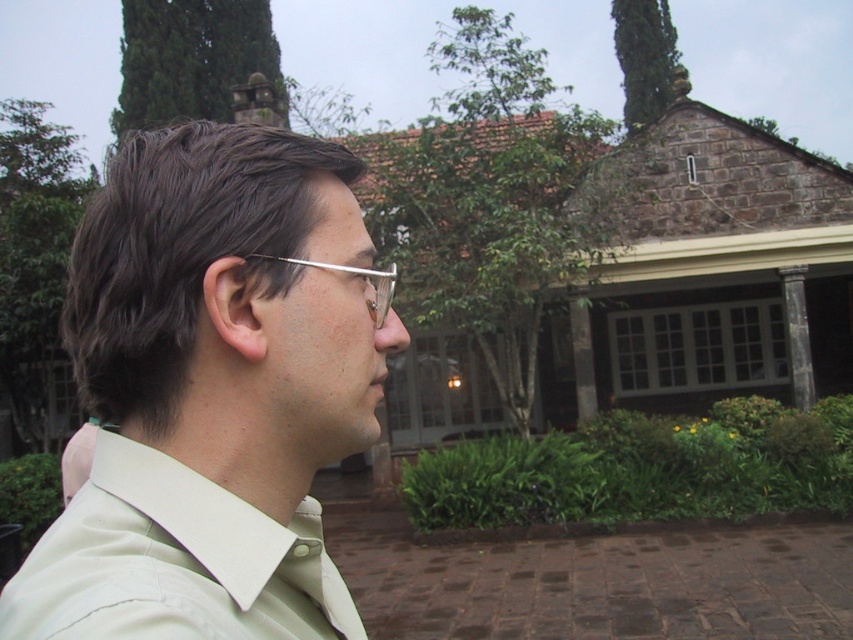
Between light beige shirt at center and beige cotton dress shirt at center, which one is positioned lower?

beige cotton dress shirt at center is lower down.

How distant is light beige shirt at center from beige cotton dress shirt at center?

They are 7.63 centimeters apart.

The height and width of the screenshot is (640, 853). Describe the element at coordinates (212, 392) in the screenshot. I see `light beige shirt at center` at that location.

Identify the location of light beige shirt at center. (212, 392).

Measure the distance between beige cotton dress shirt at center and clear plastic glasses at center.

The distance of beige cotton dress shirt at center from clear plastic glasses at center is 12.92 inches.

Does point (173, 564) lie behind point (372, 275)?

No.

Who is more distant from viewer, (151, 576) or (380, 291)?

Positioned behind is point (380, 291).

Where is `beige cotton dress shirt at center`? beige cotton dress shirt at center is located at coordinates (173, 563).

Which is in front, point (108, 524) or point (332, 266)?

Point (108, 524)

How distant is light beige shirt at center from clear plastic glasses at center?

9.56 inches

Is point (169, 625) more distant than point (379, 284)?

No, it is not.

Find the location of a particular element. light beige shirt at center is located at coordinates (212, 392).